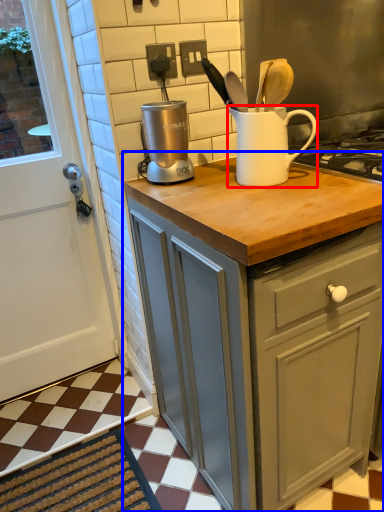
Question: Which object appears closest to the camera in this image, jug (highlighted by a red box) or cabinetry (highlighted by a blue box)?

Choices:
 (A) jug
 (B) cabinetry

Answer: (B)